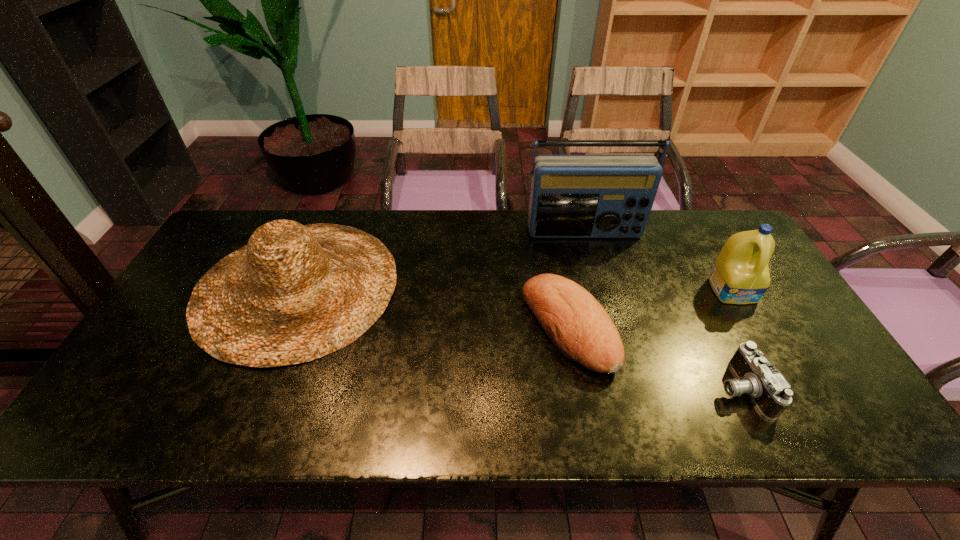
Identify the location of the tallest object. (572, 196).

Where is `detergent`? The image size is (960, 540). detergent is located at coordinates (740, 275).

Identify the location of the leftmost object. Image resolution: width=960 pixels, height=540 pixels. (295, 293).

In order to click on the third tallest object in this screenshot , I will do `click(295, 293)`.

Identify the location of bread. The width and height of the screenshot is (960, 540). (579, 327).

Identify the location of camera. This screenshot has height=540, width=960. (770, 392).

In order to click on free location located 0.210m on the front panel of the tallest object in this screenshot , I will do `click(600, 290)`.

You are a GUI agent. You are given a task and a screenshot of the screen. Output one action in this format:
    pyautogui.click(x=<x>, y=<y>)
    Task: Click on the vacant area situated 0.090m on the label of the detergent
    
    Given the screenshot: What is the action you would take?
    pyautogui.click(x=756, y=331)

The height and width of the screenshot is (540, 960). I want to click on free region located on the right of the third shortest object, so click(x=467, y=286).

Locate an element on the screen. The width and height of the screenshot is (960, 540). blank space located on the left of the bread is located at coordinates (444, 327).